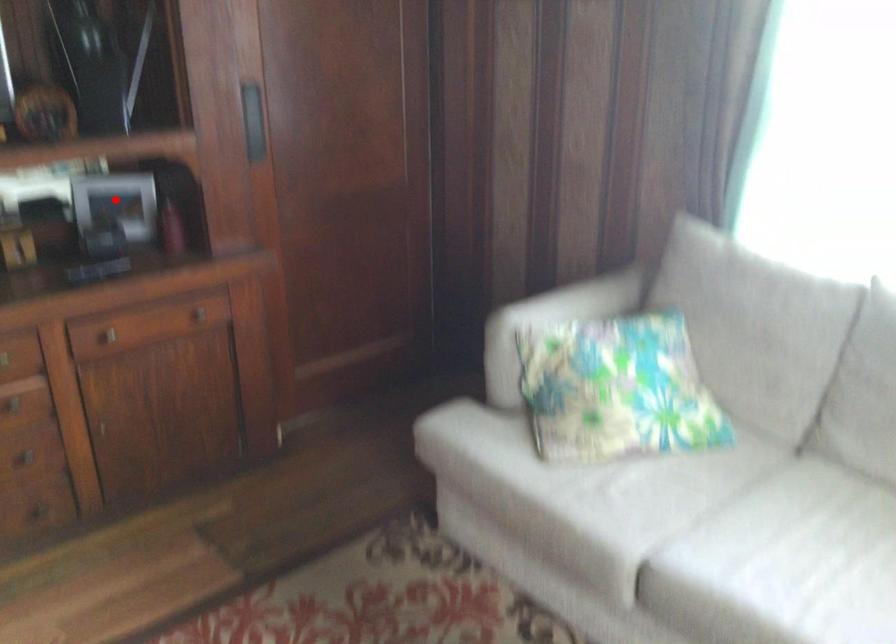
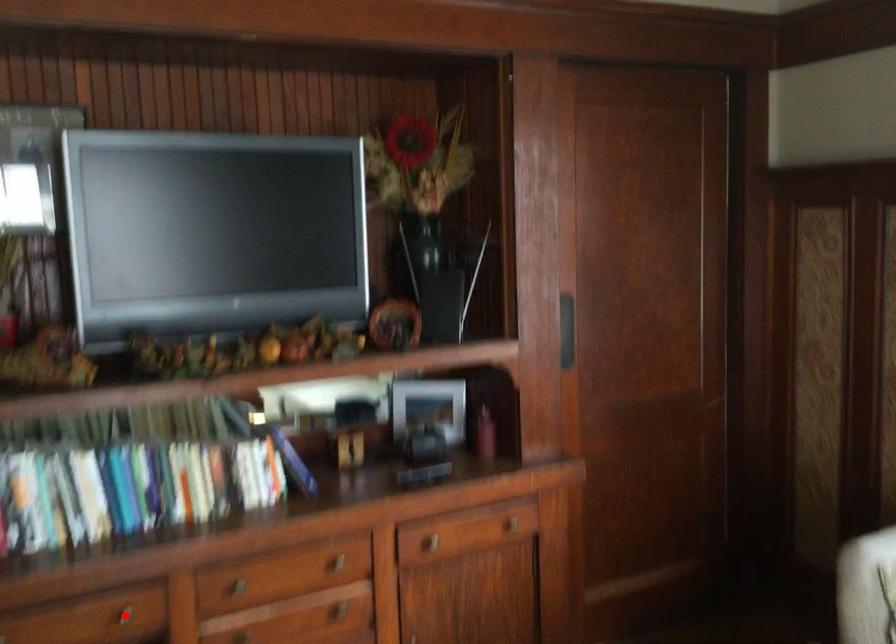
I am providing you with two images of the same scene from different viewpoints. A red point is marked on the first image and another point is marked on the second image. Do the highlighted points in image1 and image2 indicate the same real-world spot?

No